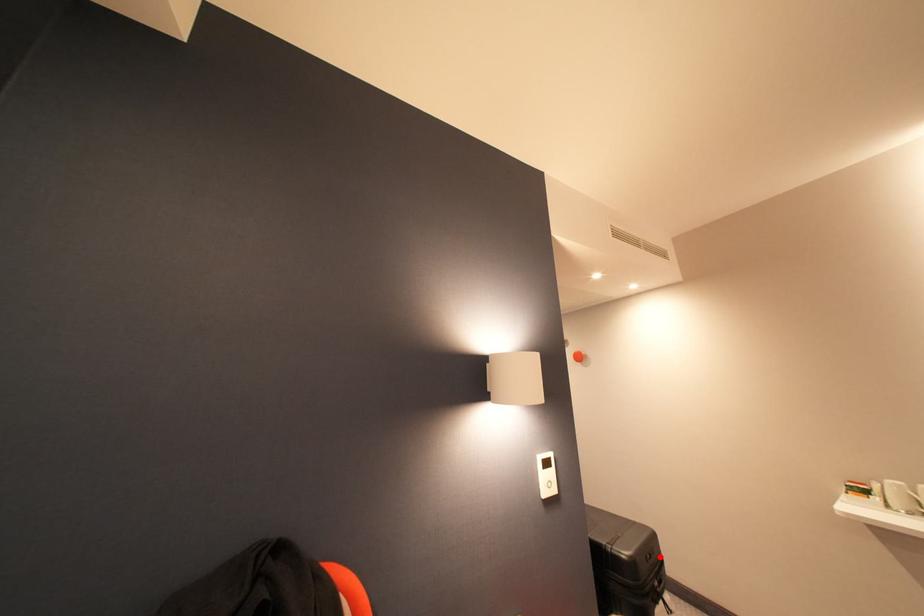
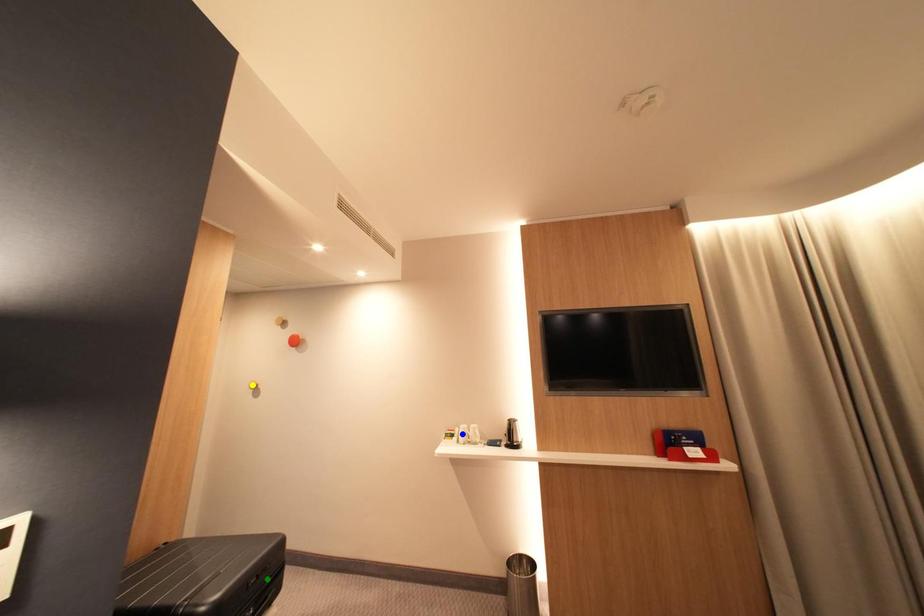
Question: I am providing you with two images of the same scene from different viewpoints. A red point is marked on the first image. You are given multiple points on the second image. Which spot in image 2 lines up with the point in image 1?

Choices:
 (A) yellow point
 (B) blue point
 (C) green point

Answer: (C)